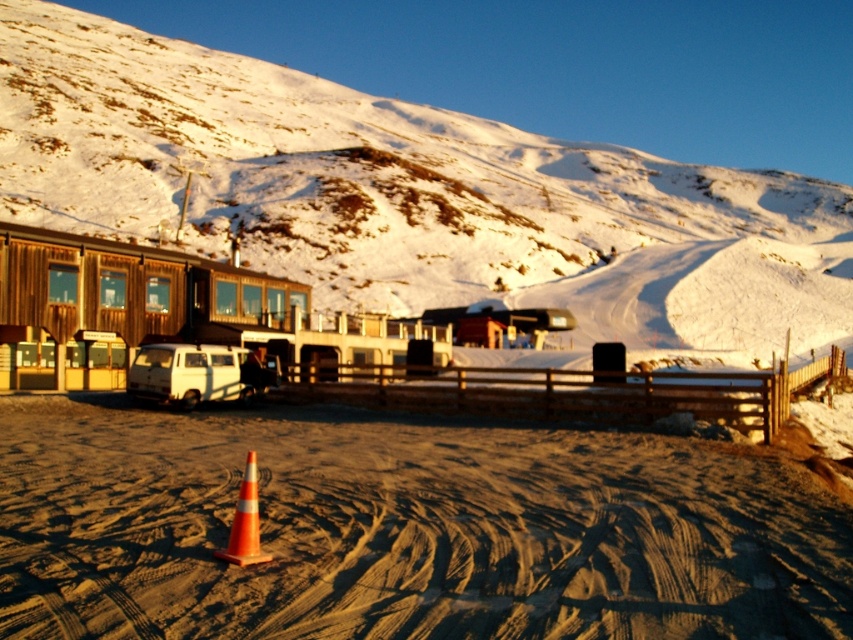
Who is taller, white matte van at center or orange reflective cone at center?

With more height is white matte van at center.

Between point (166, 364) and point (233, 544), which one is positioned in front?

Positioned in front is point (233, 544).

The width and height of the screenshot is (853, 640). Identify the location of white matte van at center. (193, 372).

Is snowy white mountain at upper center smaller than orange reflective cone at center?

No.

Between snowy white mountain at upper center and orange reflective cone at center, which one appears on the left side from the viewer's perspective?

Positioned to the left is orange reflective cone at center.

The width and height of the screenshot is (853, 640). Identify the location of snowy white mountain at upper center. (408, 195).

Is snowy white mountain at upper center positioned before white matte van at center?

No, it is not.

Can you confirm if snowy white mountain at upper center is positioned to the right of white matte van at center?

Indeed, snowy white mountain at upper center is positioned on the right side of white matte van at center.

Where is `snowy white mountain at upper center`? snowy white mountain at upper center is located at coordinates (408, 195).

The image size is (853, 640). Identify the location of snowy white mountain at upper center. (408, 195).